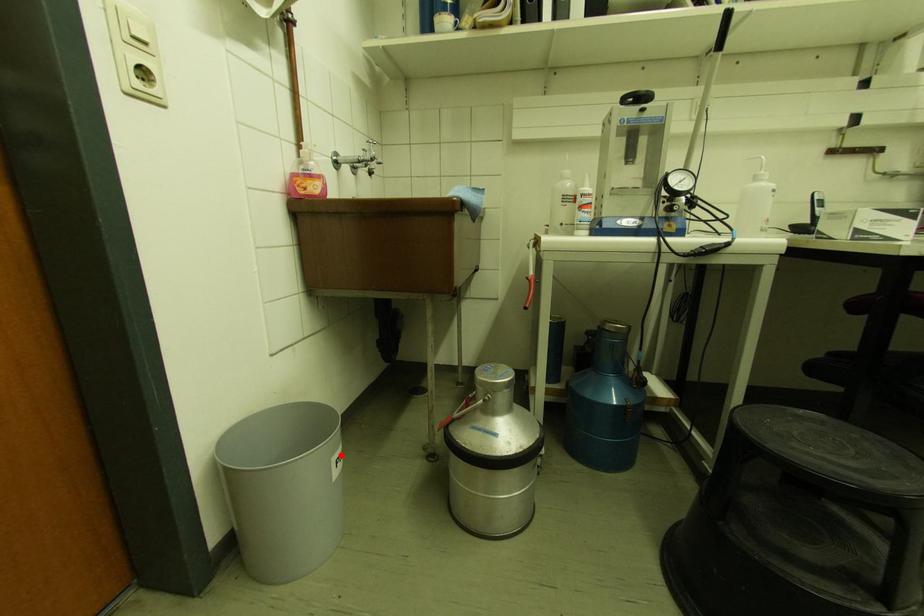
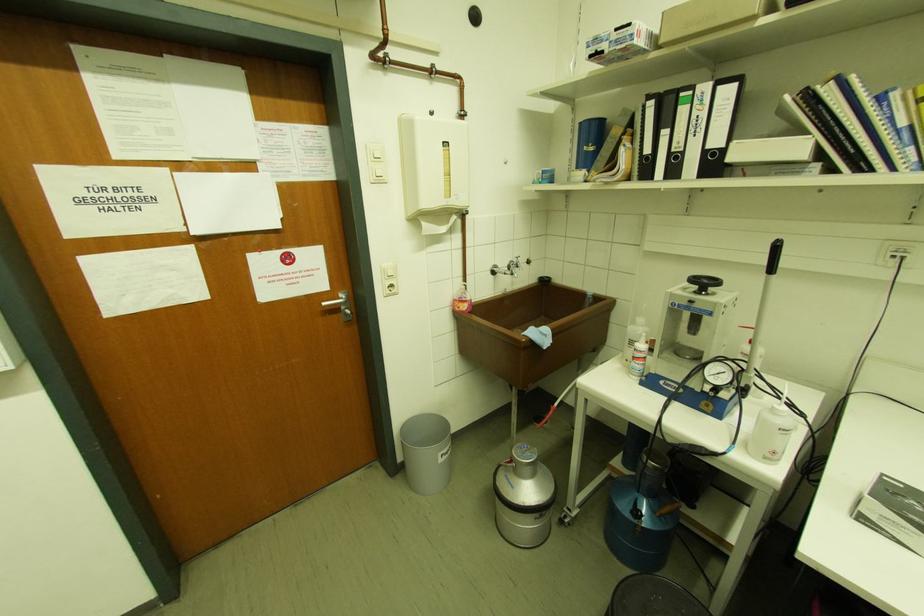
The point at the highlighted location is marked in the first image. Where is the corresponding point in the second image?

(446, 453)